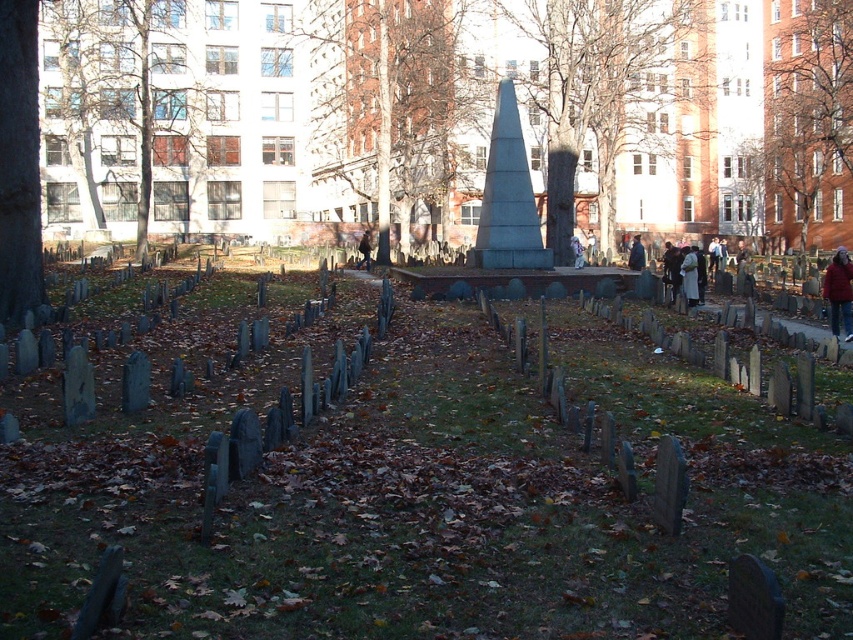
Does granite obelisk at center appear on the right side of red fleece jacket at center?

Incorrect, granite obelisk at center is not on the right side of red fleece jacket at center.

Find the location of a particular element. This screenshot has height=640, width=853. granite obelisk at center is located at coordinates (508, 196).

Does blue fabric jacket at center come behind brown leather jacket at center?

No.

Based on the photo, does blue fabric jacket at center appear under brown leather jacket at center?

Yes.

Which is behind, point (631, 269) or point (368, 253)?

The point (368, 253) is behind.

The height and width of the screenshot is (640, 853). Find the location of `blue fabric jacket at center`. blue fabric jacket at center is located at coordinates (636, 253).

Can you confirm if granite obelisk at center is bigger than brown leather jacket at center?

No, granite obelisk at center is not bigger than brown leather jacket at center.

Does granite obelisk at center appear over brown leather jacket at center?

Yes.

Where is `granite obelisk at center`? granite obelisk at center is located at coordinates (508, 196).

The image size is (853, 640). Identify the location of granite obelisk at center. (508, 196).